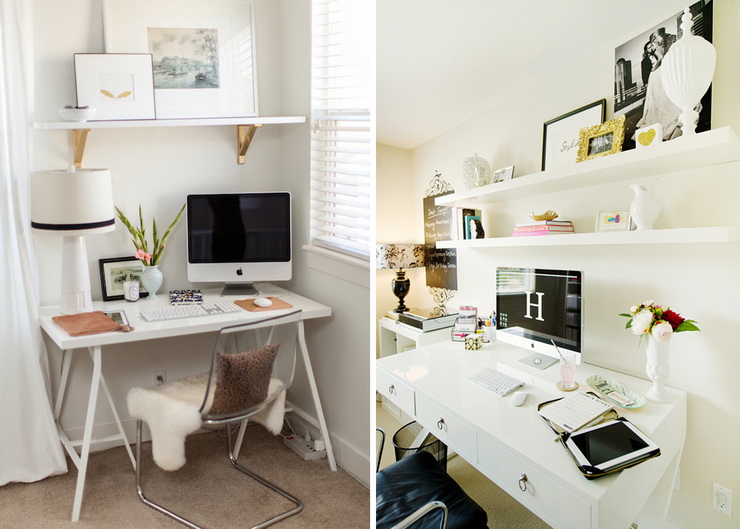
Identify the location of desk. (494, 431).